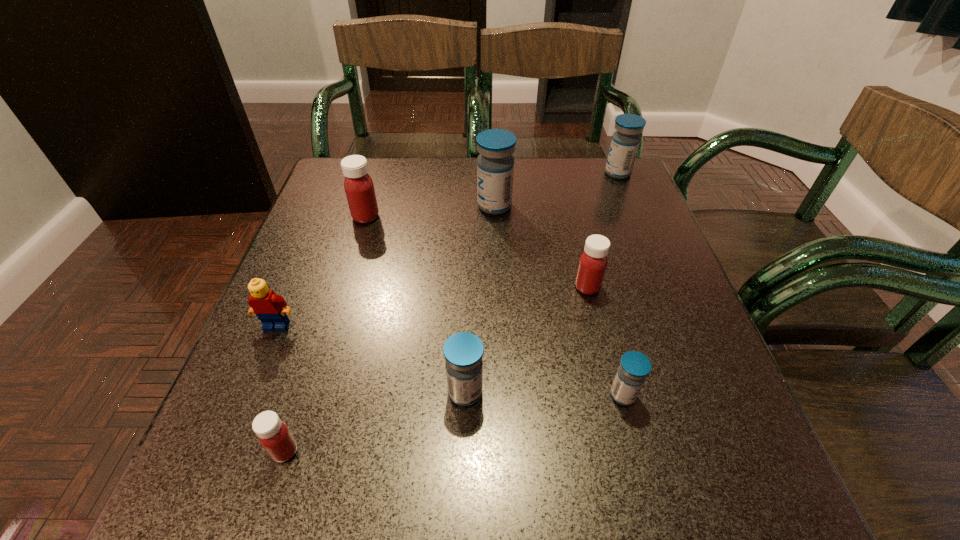
This screenshot has width=960, height=540. Find the location of `vacant space located 0.350m on the back of the nearest red medicine`. vacant space located 0.350m on the back of the nearest red medicine is located at coordinates (341, 275).

Locate an element on the screen. This screenshot has width=960, height=540. object that is at the near edge is located at coordinates click(275, 437).

Where is `Lego at the left edge`? Lego at the left edge is located at coordinates (270, 308).

Where is `object at the near left corner`? This screenshot has height=540, width=960. object at the near left corner is located at coordinates (275, 437).

Locate an element on the screen. object situated at the far right corner is located at coordinates (625, 141).

Where is `free location at the far edge`? free location at the far edge is located at coordinates (471, 200).

This screenshot has height=540, width=960. I want to click on vacant space at the near edge, so click(x=555, y=514).

The height and width of the screenshot is (540, 960). What are the coordinates of `vacant space at the left edge of the desktop` in the screenshot? It's located at (299, 242).

At what (x,y) coordinates should I click in order to perform the action: click on free spot at the right edge of the desktop. Please return your answer as a coordinate pair (x, y). The width and height of the screenshot is (960, 540). Looking at the image, I should click on (627, 292).

Locate an element on the screen. The width and height of the screenshot is (960, 540). free space at the near left corner of the desktop is located at coordinates point(205,469).